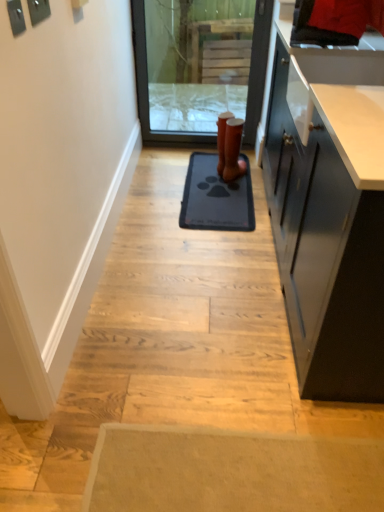
Where is `free location to the left of brown leather boot at center`? The height and width of the screenshot is (512, 384). free location to the left of brown leather boot at center is located at coordinates (210, 172).